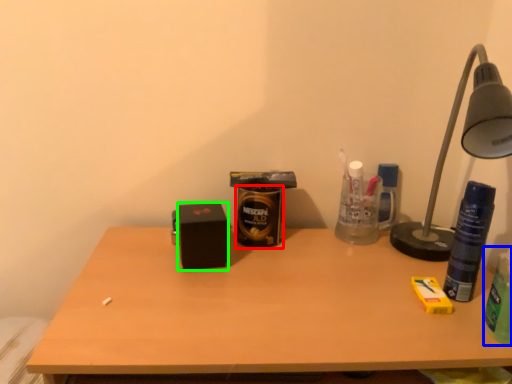
Question: Estimate the real-world distances between objects in this image. Which object is farther from beverage (highlighted by a red box), beverage (highlighted by a blue box) or box (highlighted by a green box)?

Choices:
 (A) beverage
 (B) box

Answer: (A)